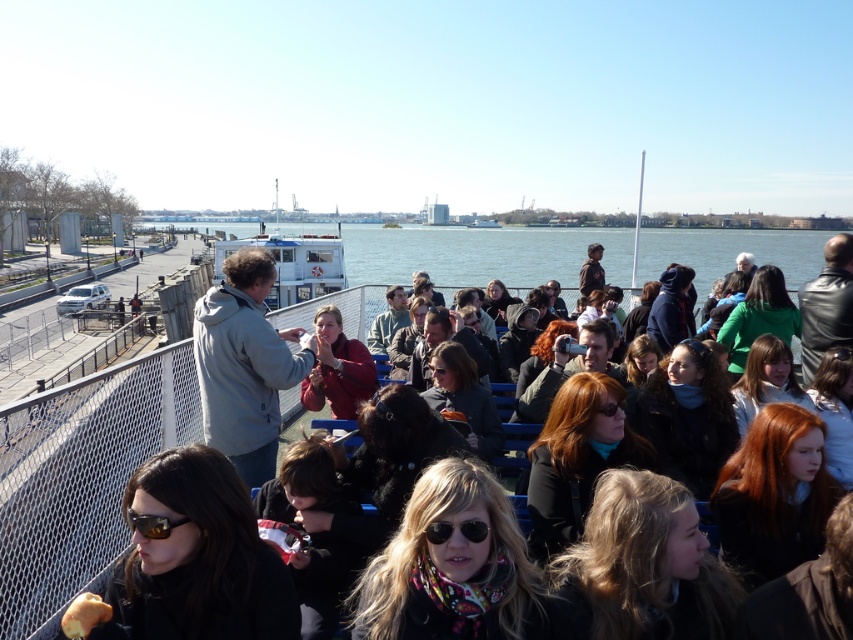
Who is lower down, gray matte jacket at upper left or white plastic ferry at center?

gray matte jacket at upper left

Does point (358, 536) come closer to viewer compared to point (341, 275)?

Yes, it is in front of point (341, 275).

Find the location of `gray matte jacket at upper left`. gray matte jacket at upper left is located at coordinates (383, 508).

Between gray fleece jacket at center and white plastic ferry at center, which one has less height?

gray fleece jacket at center

Which is behind, point (206, 320) or point (300, 280)?

The point (300, 280) is behind.

Is point (236, 273) more distant than point (267, 304)?

No, (236, 273) is in front of (267, 304).

Locate an element on the screen. The height and width of the screenshot is (640, 853). gray fleece jacket at center is located at coordinates (244, 364).

Between point (473, 540) and point (613, 412), which one is positioned in front?

Point (473, 540) is more forward.

Can you confirm if sunglasses at center is positioned to the right of matte black sunglasses at center?

In fact, sunglasses at center is to the left of matte black sunglasses at center.

Is point (457, 524) farther from camera compared to point (596, 408)?

No, it is not.

Image resolution: width=853 pixels, height=640 pixels. Identify the location of sunglasses at center. (457, 529).